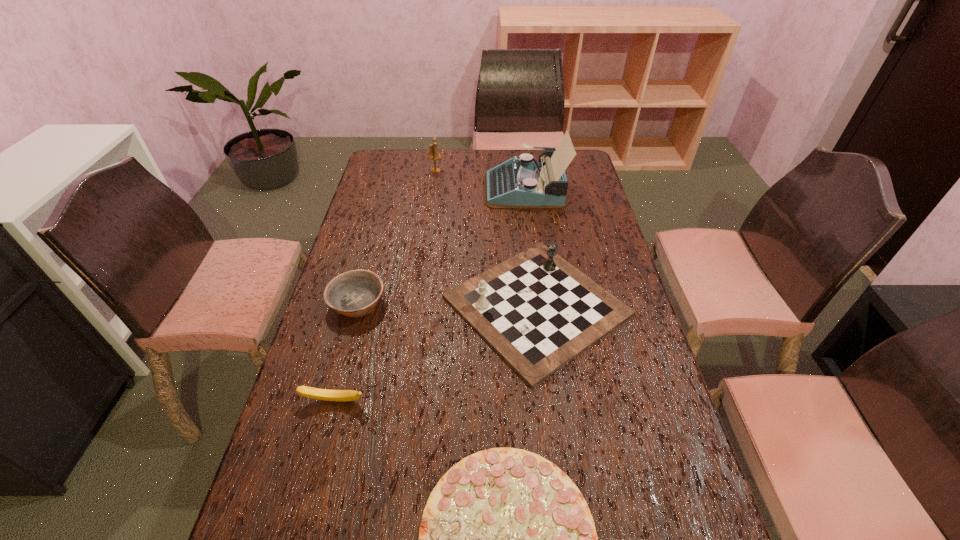
Where is `the fourth closest object to the typewriter`? The image size is (960, 540). the fourth closest object to the typewriter is located at coordinates (315, 393).